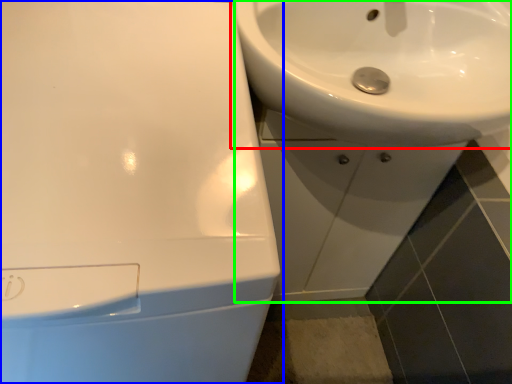
Question: Which object is positioned closest to sink (highlighted by a red box)? Select from sink (highlighted by a blue box) and sink (highlighted by a green box).

Choices:
 (A) sink
 (B) sink

Answer: (B)